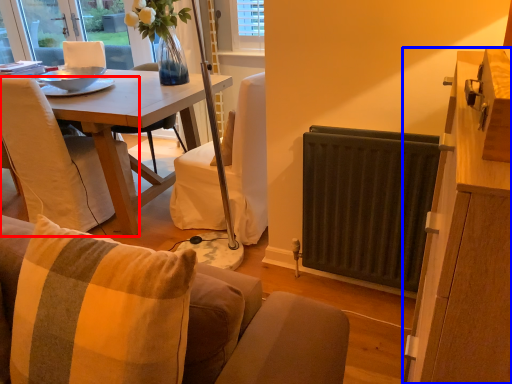
Question: Which object is closer to the camera taking this photo, chair (highlighted by a red box) or cabinetry (highlighted by a blue box)?

Choices:
 (A) chair
 (B) cabinetry

Answer: (B)